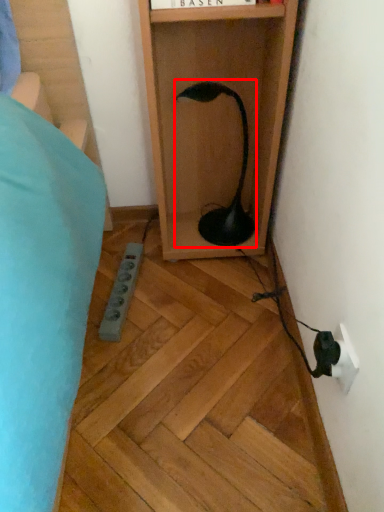
Question: In this image, where is lamp (annotated by the red box) located relative to electric outlet?

Choices:
 (A) right
 (B) left

Answer: (B)